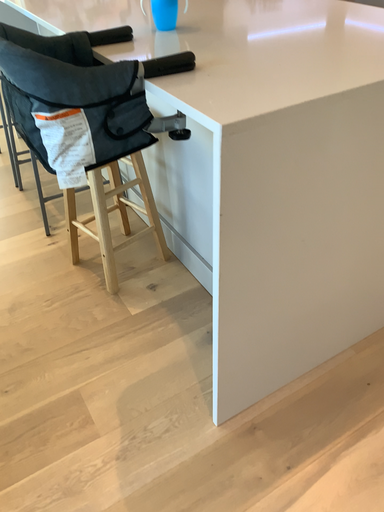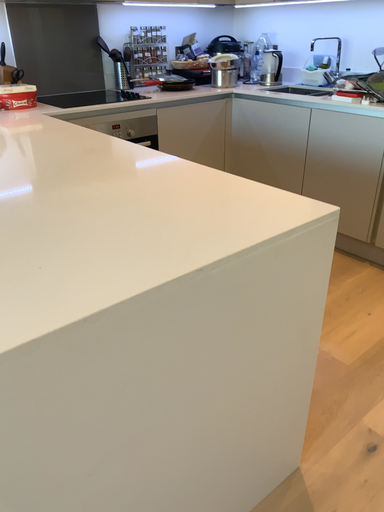
Question: How did the camera likely rotate when shooting the video?

Choices:
 (A) rotated downward
 (B) rotated upward

Answer: (B)